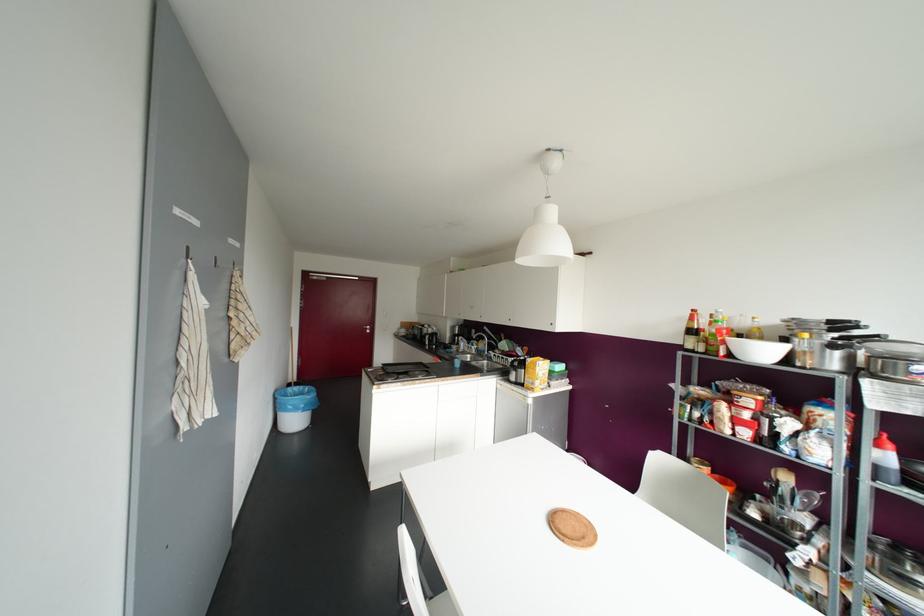
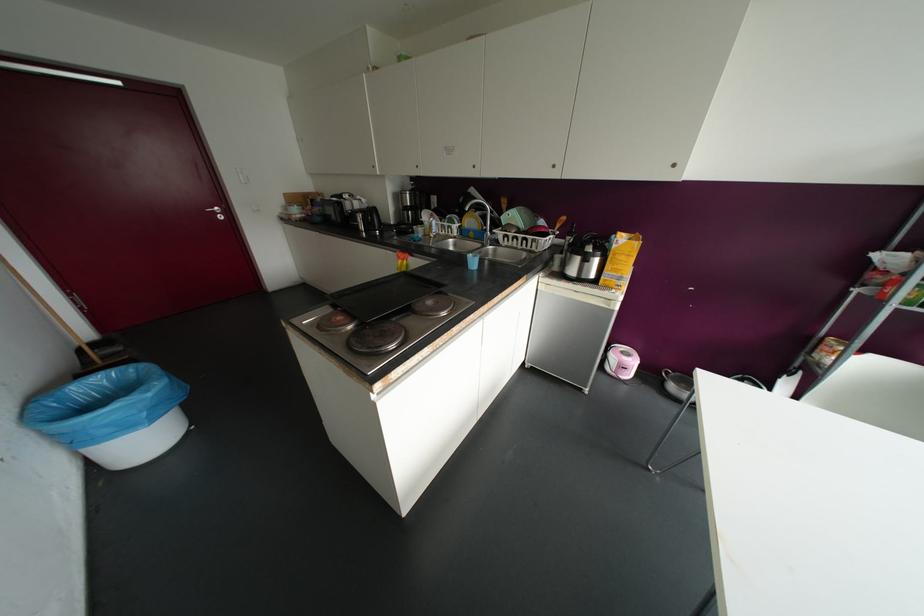
Find the pixel in the second image that matches (297,387) in the first image.

(100, 379)